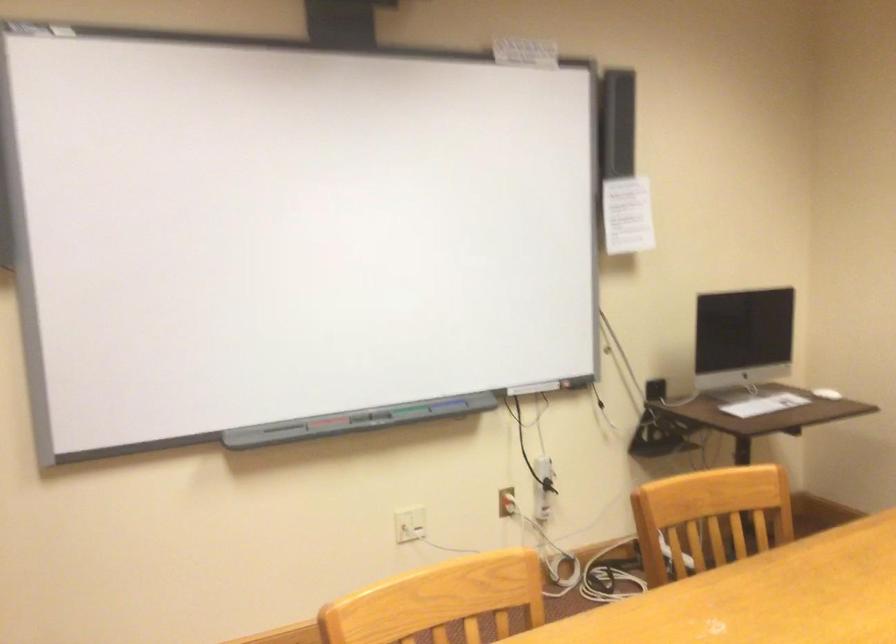
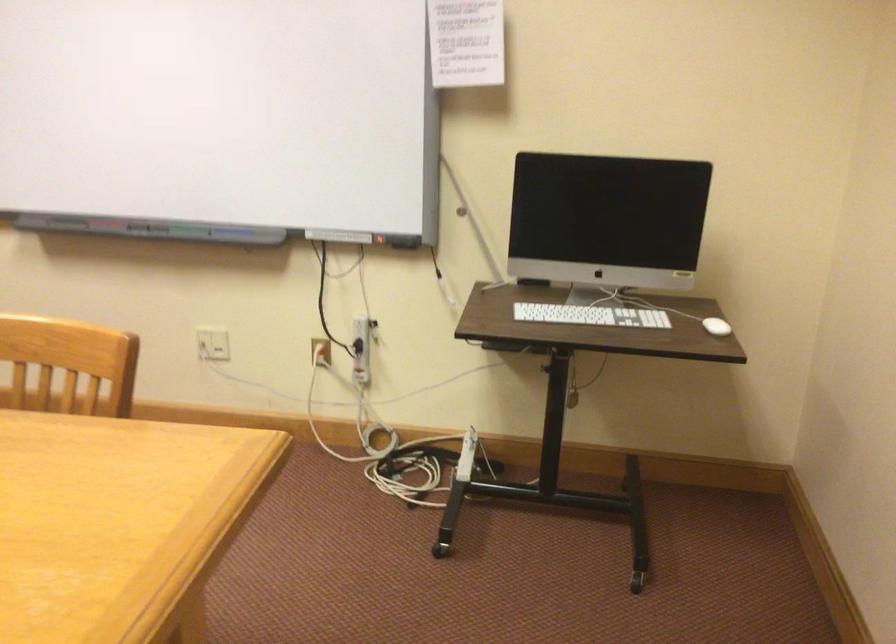
Find the pixel in the second image that matches pixel 776 402 in the first image.

(590, 315)